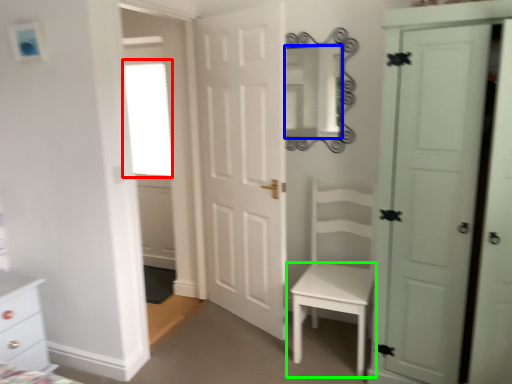
Question: Based on their relative distances, which object is farther from window (highlighted by a red box)? Choose from mirror (highlighted by a blue box) and table (highlighted by a green box).

Choices:
 (A) mirror
 (B) table

Answer: (B)